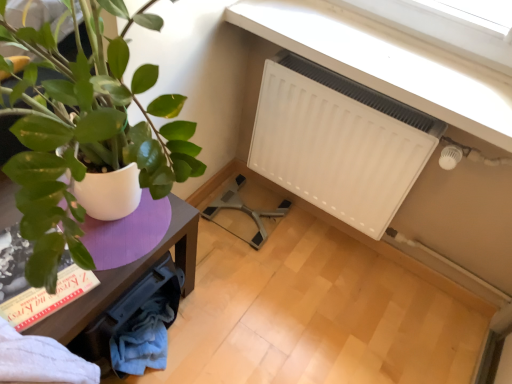
You are a GUI agent. You are given a task and a screenshot of the screen. Output one action in this format:
    pyautogui.click(x=<x>, y=<y>)
    Task: Click on the blank space situated above hardcover book at lower left (from a real-world perspective)
    The height and width of the screenshot is (384, 512).
    Given the screenshot: What is the action you would take?
    (23, 278)